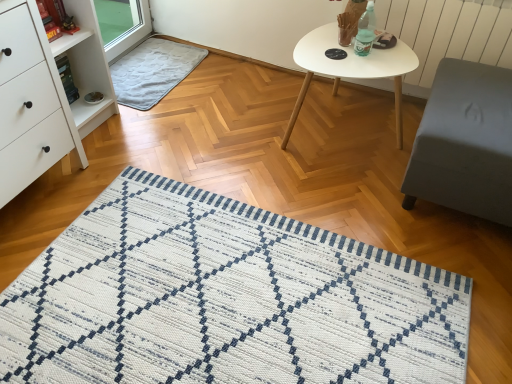
I want to click on vacant region to the left of gray matte ottoman at right, so click(346, 196).